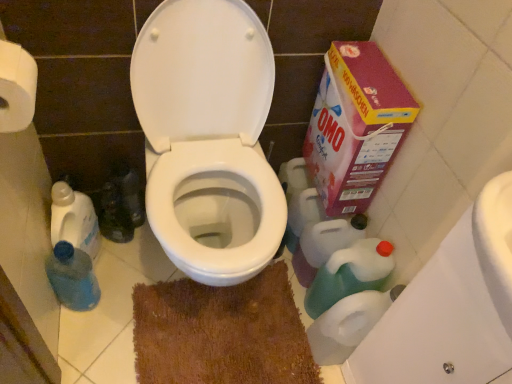
Where is `vacant point to the right of blue plastic bottle at lower left, marked as the 2th cleaning product in a left-to-right arrangement`? This screenshot has height=384, width=512. vacant point to the right of blue plastic bottle at lower left, marked as the 2th cleaning product in a left-to-right arrangement is located at coordinates (122, 308).